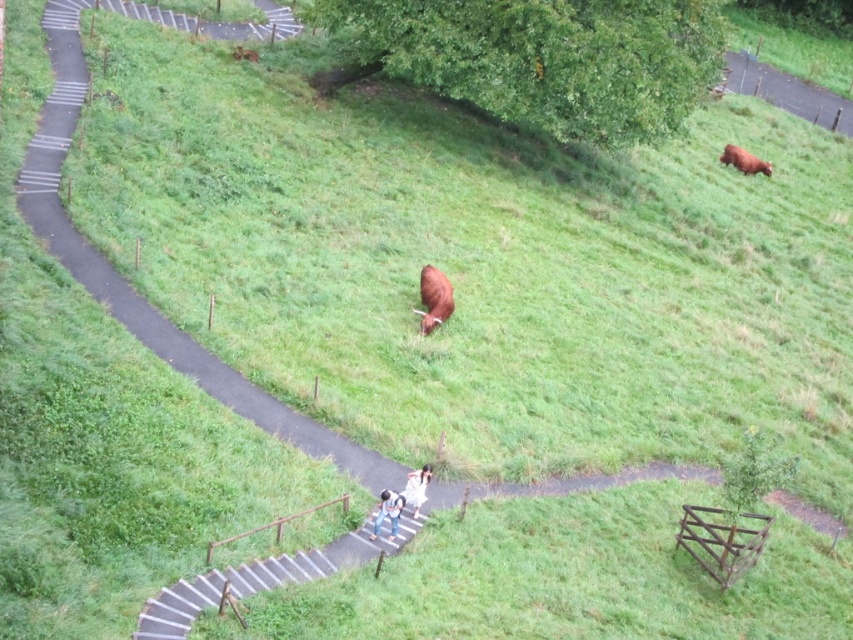
You are standing at the base of the stairs on the path and want to climb up. There are two points marked on the stairs. Which point, point (404, 499) or point (421, 467), is closer to you as you start climbing?

Point (404, 499) is closer to the viewer than point (421, 467). Therefore, as you start climbing the stairs, point (404, 499) will be nearer to you.

You are standing at the base of the stairs on the path and want to take a photo of both the point at coordinates [392,532] and the point at [762,164]. Which point will appear larger in your camera view?

The point at coordinates [392,532] will appear larger in your camera view because it is closer to the camera than the point at [762,164].